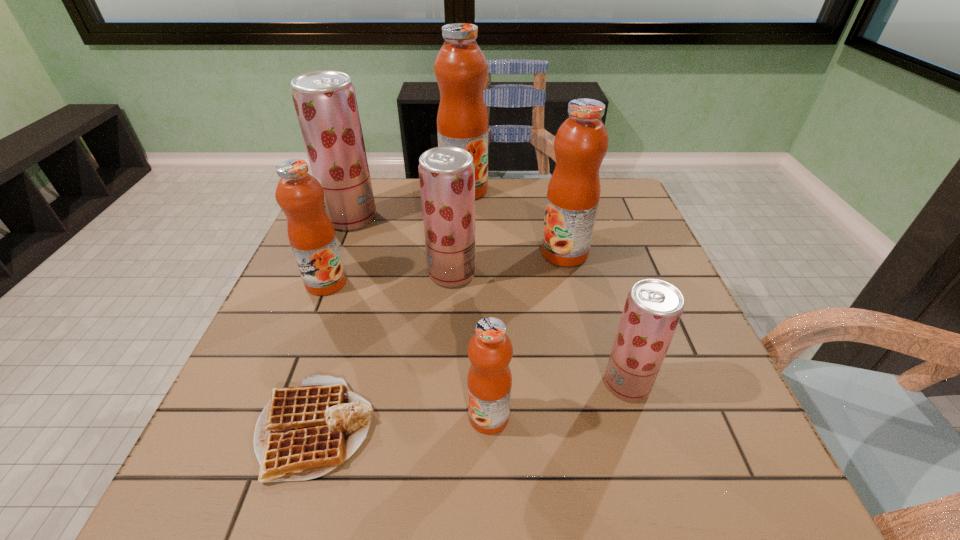
Where is `the smallest strawberry fruit juice`? The height and width of the screenshot is (540, 960). the smallest strawberry fruit juice is located at coordinates (653, 308).

Identify the location of the rightmost strawberry fruit juice. This screenshot has height=540, width=960. (653, 308).

Image resolution: width=960 pixels, height=540 pixels. I want to click on the smallest orange fruit juice, so click(x=489, y=382).

Where is `the shortest object`? the shortest object is located at coordinates (304, 432).

Locate an element on the screen. Image resolution: width=960 pixels, height=540 pixels. vacant space located on the front label of the farthest orange fruit juice is located at coordinates (459, 290).

Identify the location of vacant region located on the back of the sixth nearest fruit juice. (366, 183).

Where is `free space located on the front label of the third smallest orange fruit juice`? The image size is (960, 540). free space located on the front label of the third smallest orange fruit juice is located at coordinates (434, 253).

At what (x,y) coordinates should I click in order to perform the action: click on vacant area located on the front label of the third smallest orange fruit juice. Please return your answer as a coordinate pair (x, y). The width and height of the screenshot is (960, 540). Looking at the image, I should click on (442, 253).

I want to click on vacant area situated on the front label of the third smallest orange fruit juice, so click(x=454, y=253).

Identify the location of blank area located 0.240m on the right of the second farthest strawberry fruit juice. Image resolution: width=960 pixels, height=540 pixels. tap(576, 273).